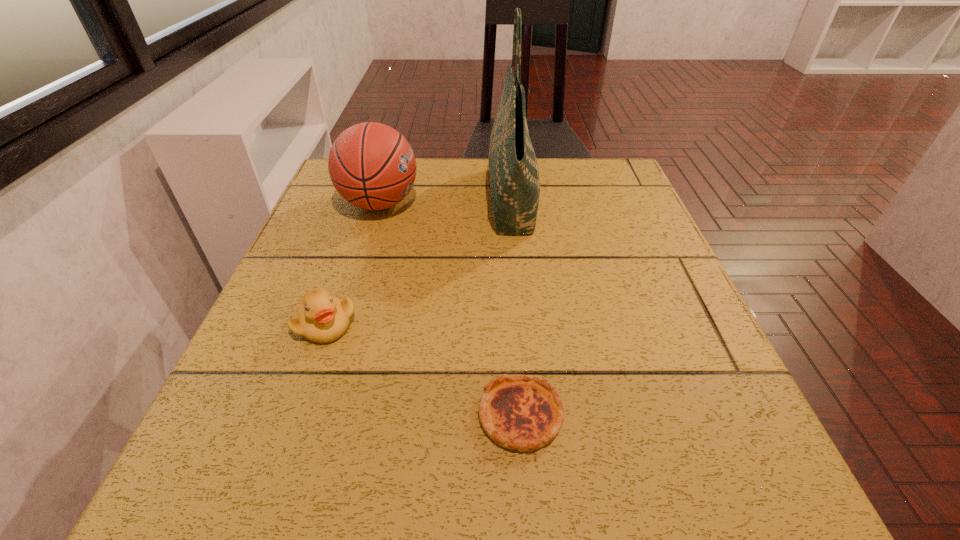
Where is `tote bag`? tote bag is located at coordinates (514, 174).

Find the location of a particular element. basketball is located at coordinates (371, 165).

Find the location of a particular element. the third tallest object is located at coordinates (321, 318).

Where is `the second nearest object`? the second nearest object is located at coordinates (321, 318).

Locate an element on the screen. the nearest object is located at coordinates (521, 412).

Find the location of a particular element. The height and width of the screenshot is (540, 960). the shortest object is located at coordinates (521, 412).

In order to click on vacant space located on the front of the tote bag in this screenshot , I will do `click(529, 388)`.

Locate an element on the screen. The image size is (960, 540). free region located on the logo side of the basketball is located at coordinates (530, 204).

Image resolution: width=960 pixels, height=540 pixels. Identify the location of free space located on the beak of the duckling. (298, 405).

Identify the location of vacant area located on the left of the shortest object. The height and width of the screenshot is (540, 960). (269, 415).